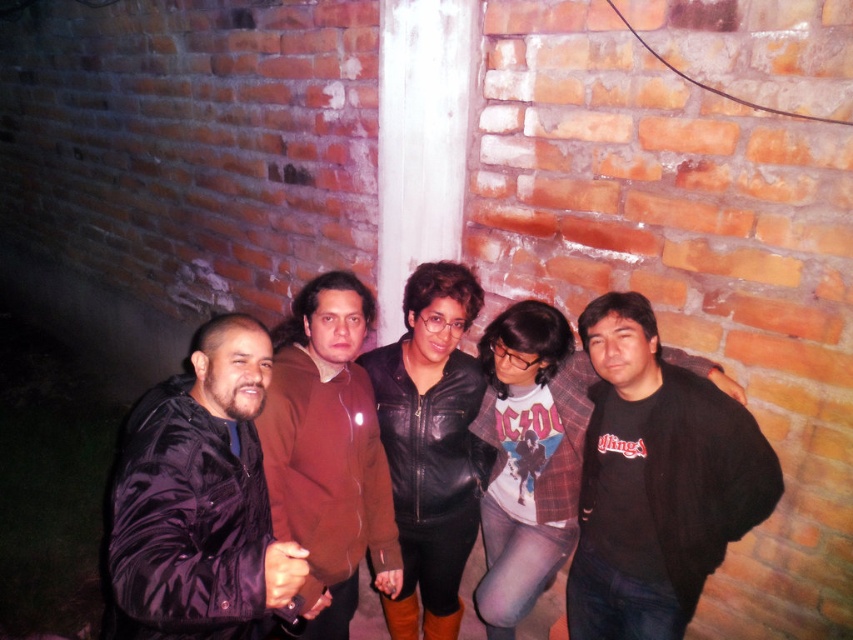
Question: Does black cotton t-shirt at center have a smaller size compared to black leather jacket at center?

Choices:
 (A) no
 (B) yes

Answer: (B)

Question: Which object is closer to the camera taking this photo?

Choices:
 (A) brown sweater at center
 (B) black leather jacket at center

Answer: (A)

Question: Does shiny black jacket at center appear under black leather jacket at center?

Choices:
 (A) yes
 (B) no

Answer: (B)

Question: Which point is closer to the camera?

Choices:
 (A) shiny black jacket at center
 (B) black leather jacket at center
 (C) brown sweater at center

Answer: (A)

Question: Which point is farther to the camera?

Choices:
 (A) 317,454
 (B) 123,632

Answer: (A)

Question: Is shiny black jacket at center bigger than black leather jacket at center?

Choices:
 (A) no
 (B) yes

Answer: (B)